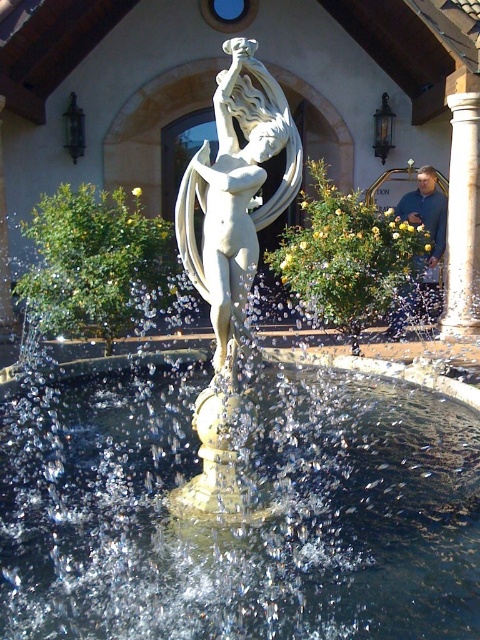
You are standing in front of the fountain and want to take a photo of the white marble statue at center. However, the clear water at center is blocking your view. Can you move to the right side to get a better shot?

The clear water at center is to the left of the white marble statue at center. Moving to the right side would allow you to position yourself away from the water obstruction, providing an unobstructed view of the white marble statue at center.

You are standing in a park and see the fountain with the clear water at center and the white marble pillar at right. Which object takes up more space in the image?

The white marble pillar at right occupies more space than the clear water at center.